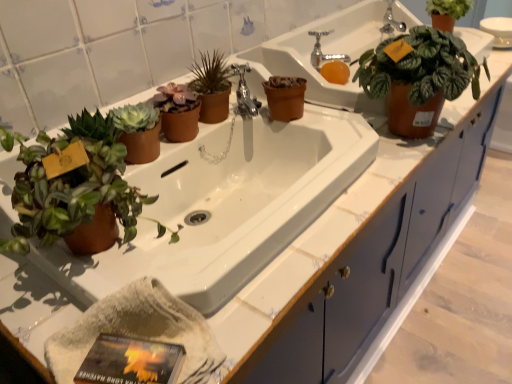
Question: Considering the positions of matte brown pot at center, which is counted as the 2th houseplant, starting from the left, and green matte plant at upper right, which is the third houseplant from back to front, in the image, is matte brown pot at center, which is counted as the 2th houseplant, starting from the left, taller or shorter than green matte plant at upper right, which is the third houseplant from back to front,?

Choices:
 (A) short
 (B) tall

Answer: (A)

Question: From the image's perspective, is matte brown pot at center, which is counted as the 3th houseplant, starting from the front, located above or below green matte plant at upper right, which is the third houseplant from back to front?

Choices:
 (A) above
 (B) below

Answer: (B)

Question: Which object is the closest to the hardcover book at lower left?

Choices:
 (A) green matte plant at upper right, acting as the third houseplant starting from the left
 (B) polished chrome faucet at center
 (C) matte brown pot at upper left
 (D) silver metallic faucet at upper center, acting as the 2th faucet starting from the front
 (E) matte brown pot at left, which is the fourth houseplant from right to left

Answer: (E)

Question: Which object is the closest to the silver metallic faucet at upper center, marked as the 2th faucet in a top-to-bottom arrangement?

Choices:
 (A) matte brown pot at left, placed as the 1th houseplant when sorted from left to right
 (B) hardcover book at lower left
 (C) matte brown pot at upper left
 (D) green matte plant at upper right, the 2th houseplant in the right-to-left sequence
 (E) silver metallic faucet at upper center, which ranks as the 1th faucet in back-to-front order

Answer: (E)